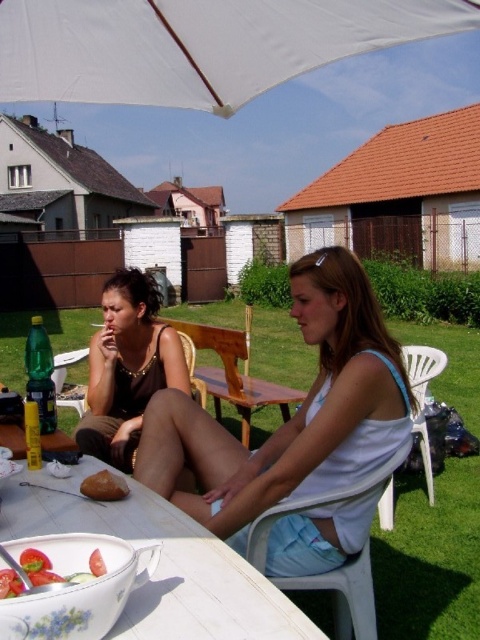
You are standing at the center of the image. There is a point at coordinates [292,416]. What object is located at that point?

The white fabric tank top at center is located at point [292,416].

You are a server at a cafe and need to place a new menu on the table. The menu is 12 inches wide. Can you fit it on the white glossy table at lower center without overlapping the matte black tank top at center?

The white glossy table at lower center is wider than the matte black tank top at center, so the 12 inch menu should fit without overlapping as long as it is placed appropriately.

You are a photographer standing at a certain distance from the scene. You want to capture a closeup shot of the white fabric tank top at center without moving the camera. Is the current distance sufficient for a clear closeup? Please explain.

The white fabric tank top at center is 1.81 meters away from the camera. A typical closeup requires the subject to be within 1 meter of the camera lens. Since the distance is greater than 1 meter, the current distance is insufficient for a clear closeup without moving the camera or using a zoom lens.